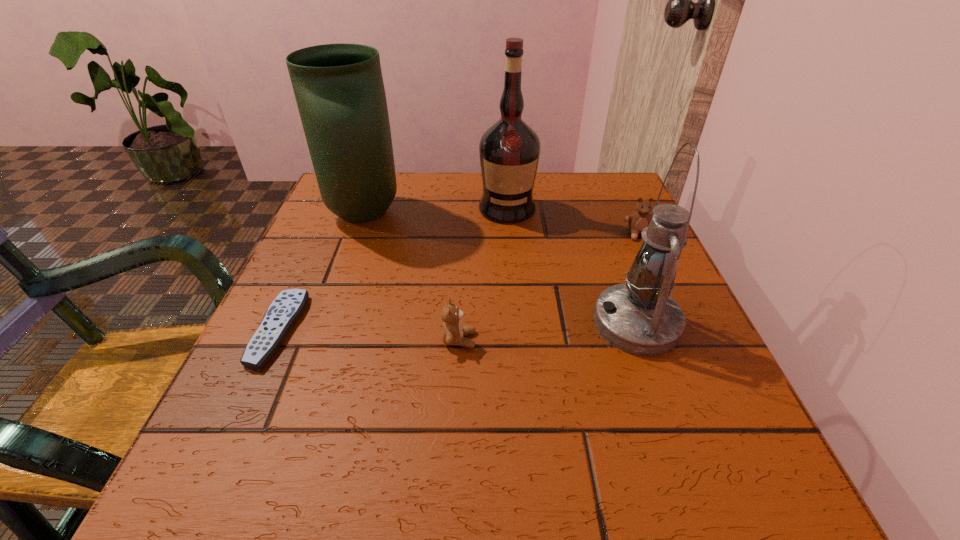
You are a GUI agent. You are given a task and a screenshot of the screen. Output one action in this format:
    pyautogui.click(x=<x>, y=<y>)
    Task: Click on the empty space that is in between the fourth object from left to right and the remote control
    
    Given the screenshot: What is the action you would take?
    pyautogui.click(x=393, y=269)

Identify the location of vacant space that is in between the nearer teddy bear and the oil lamp. Image resolution: width=960 pixels, height=540 pixels. (548, 332).

Identify the location of unoccupied position between the right teddy bear and the vase. The width and height of the screenshot is (960, 540). (501, 224).

Locate an element on the screen. Image resolution: width=960 pixels, height=540 pixels. vacant area that lies between the oil lamp and the nearer teddy bear is located at coordinates (548, 332).

Where is `vacant area that lies between the vase and the farther teddy bear`? Image resolution: width=960 pixels, height=540 pixels. vacant area that lies between the vase and the farther teddy bear is located at coordinates (501, 224).

Where is `object that stands as the closest to the nearer teddy bear`? This screenshot has height=540, width=960. object that stands as the closest to the nearer teddy bear is located at coordinates (639, 317).

You are a GUI agent. You are given a task and a screenshot of the screen. Output one action in this format:
    pyautogui.click(x=<x>, y=<y>)
    Task: Click on the object that is the closest to the liquor
    The height and width of the screenshot is (540, 960).
    Given the screenshot: What is the action you would take?
    pyautogui.click(x=339, y=89)

Find the location of `free spot that satisfies the following two spatial constraints: 1. on the back side of the vase; 2. on the left side of the remote control`. free spot that satisfies the following two spatial constraints: 1. on the back side of the vase; 2. on the left side of the remote control is located at coordinates (332, 214).

Locate an element on the screen. The image size is (960, 540). vacant point that satisfies the following two spatial constraints: 1. on the front side of the vase; 2. on the right side of the oil lamp is located at coordinates (325, 323).